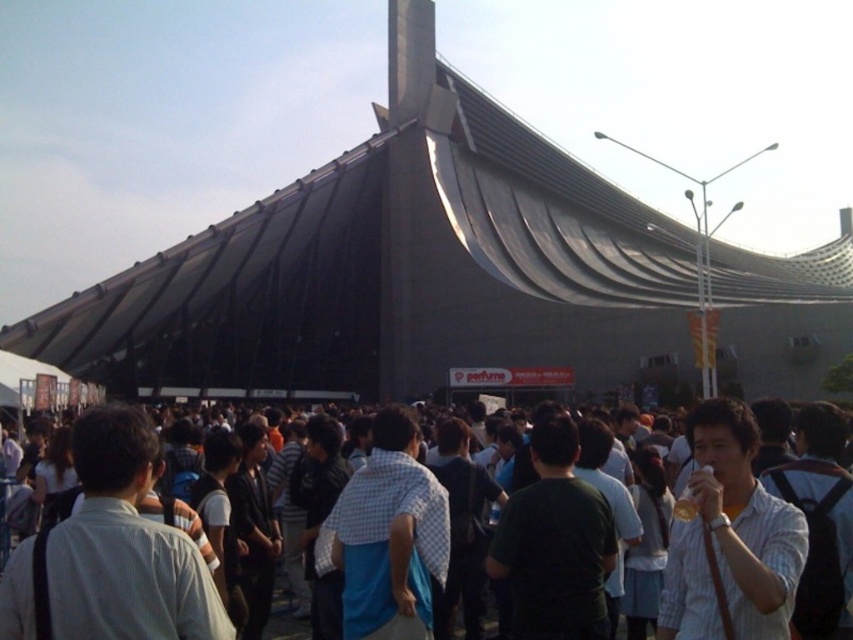
Does dark casual clothing at center appear under white striped shirt at center?

Indeed, dark casual clothing at center is positioned under white striped shirt at center.

Does dark casual clothing at center have a smaller size compared to white striped shirt at center?

No.

This screenshot has width=853, height=640. Find the location of `dark casual clothing at center`. dark casual clothing at center is located at coordinates (109, 554).